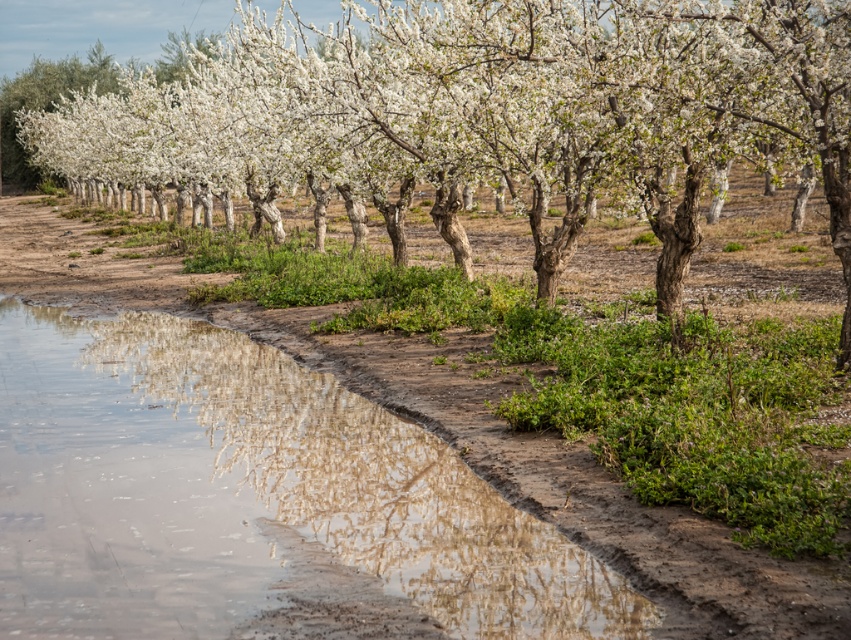
Is muddy water at lower left above white blossoming tree at center?

Incorrect, muddy water at lower left is not positioned above white blossoming tree at center.

Between muddy water at lower left and white blossoming tree at center, which one appears on the left side from the viewer's perspective?

white blossoming tree at center is more to the left.

Which is in front, point (153, 444) or point (825, 186)?

Point (153, 444) is in front.

Where is `muddy water at lower left`? This screenshot has width=851, height=640. muddy water at lower left is located at coordinates (246, 492).